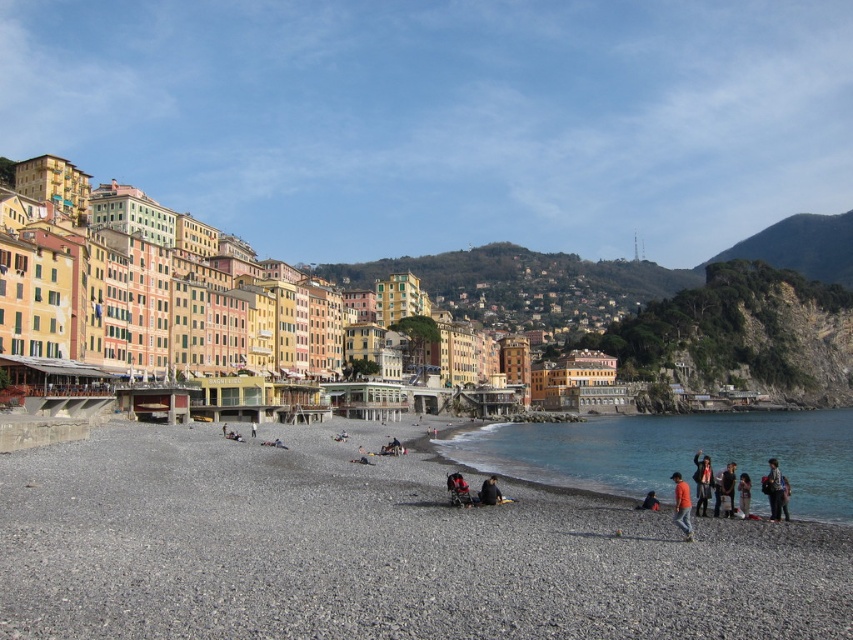
Question: Does blue denim jeans at lower right have a smaller size compared to orange fabric person at lower right?

Choices:
 (A) yes
 (B) no

Answer: (B)

Question: Is the position of gray gravel beach at lower center more distant than that of orange fabric person at lower right?

Choices:
 (A) no
 (B) yes

Answer: (A)

Question: Does dark blue jeans at lower right have a lesser width compared to dark brown leather jacket at lower right?

Choices:
 (A) yes
 (B) no

Answer: (B)

Question: Based on their relative distances, which object is nearer to the blue denim jeans at lower right?

Choices:
 (A) clear blue water at lower right
 (B) dark gray fabric jacket at lower center

Answer: (B)

Question: Which object is farther from the camera taking this photo?

Choices:
 (A) dark blue denim jacket at lower right
 (B) orange fabric person at lower right
 (C) dark blue jeans at lower right
 (D) dark gray fabric jacket at lower center

Answer: (D)

Question: Which point is farther to the camera?

Choices:
 (A) gray gravel beach at lower center
 (B) dark brown leather jacket at lower right
 (C) clear blue water at lower right
 (D) dark blue jeans at lower right

Answer: (B)